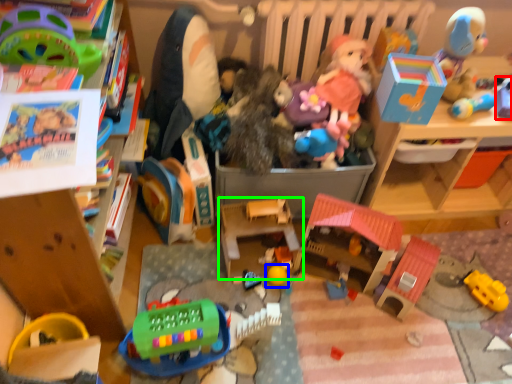
Question: Considering the real-world distances, which object is closest to toy (highlighted by a red box)? toy (highlighted by a blue box) or toy (highlighted by a green box).

Choices:
 (A) toy
 (B) toy

Answer: (B)